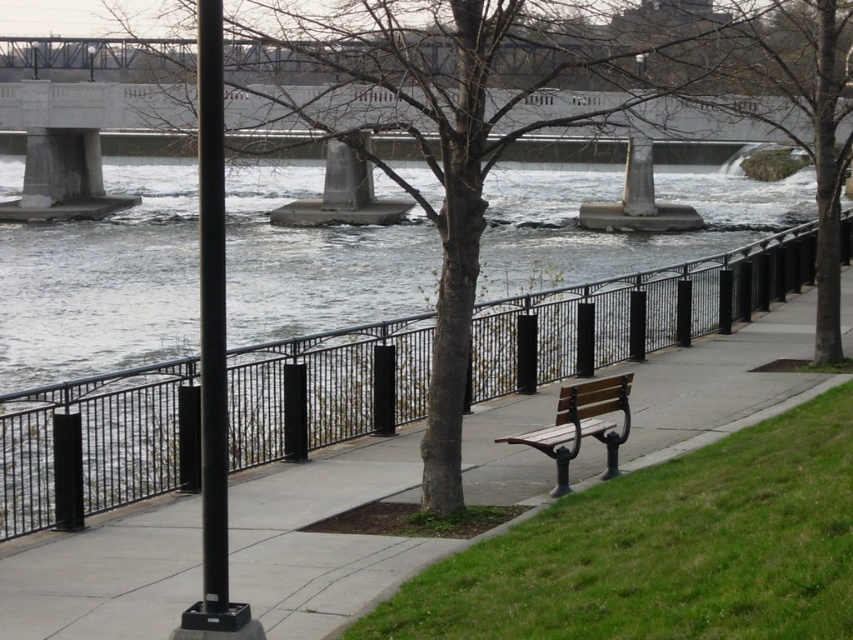
Who is shorter, black metal railing at center or wooden bench at center?

With less height is wooden bench at center.

Between black metal railing at center and wooden bench at center, which one has more height?

With more height is black metal railing at center.

Between point (144, 417) and point (567, 388), which one is positioned in front?

Point (567, 388) is more forward.

The height and width of the screenshot is (640, 853). What are the coordinates of `black metal railing at center` in the screenshot? It's located at (630, 314).

Looking at this image, who is lower down, black metal railing at center or brown/dry bark tree at center?

black metal railing at center is lower down.

Can you confirm if black metal railing at center is positioned below brown/dry bark tree at center?

Indeed, black metal railing at center is positioned under brown/dry bark tree at center.

Locate an element on the screen. black metal railing at center is located at coordinates (630, 314).

Who is shorter, brown/dry bark tree at center or wooden bench at center?

wooden bench at center

Is point (456, 289) more distant than point (556, 424)?

No, it is in front of (556, 424).

You are a GUI agent. You are given a task and a screenshot of the screen. Output one action in this format:
    pyautogui.click(x=<x>, y=<y>)
    Task: Click on the brown/dry bark tree at center
    The image size is (853, 640).
    Given the screenshot: What is the action you would take?
    pyautogui.click(x=468, y=122)